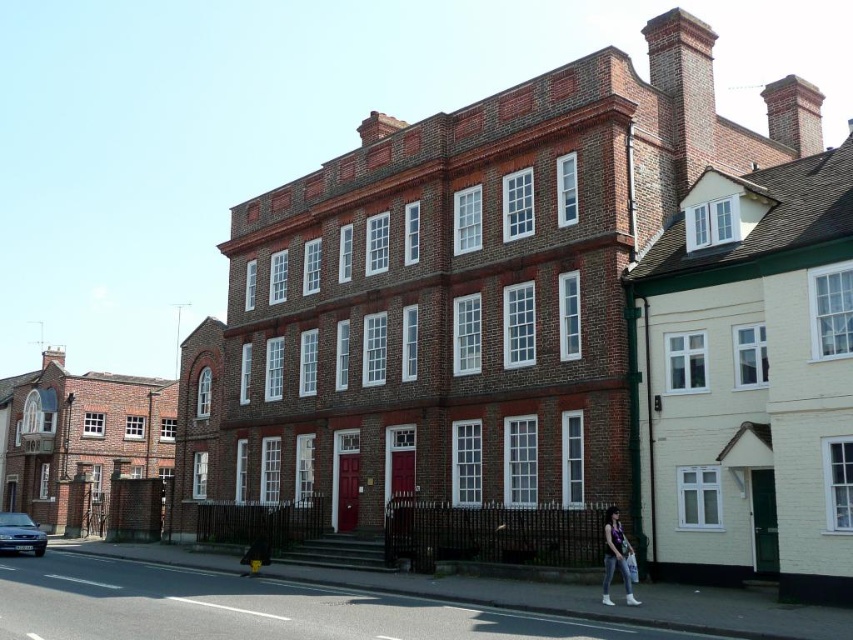
Is matte purple top at lower right smaller than metallic blue sedan at lower left?

Correct, matte purple top at lower right occupies less space than metallic blue sedan at lower left.

Between point (610, 515) and point (10, 522), which one is positioned behind?

The point (10, 522) is behind.

Where is `matte purple top at lower right`? This screenshot has width=853, height=640. matte purple top at lower right is located at coordinates (614, 556).